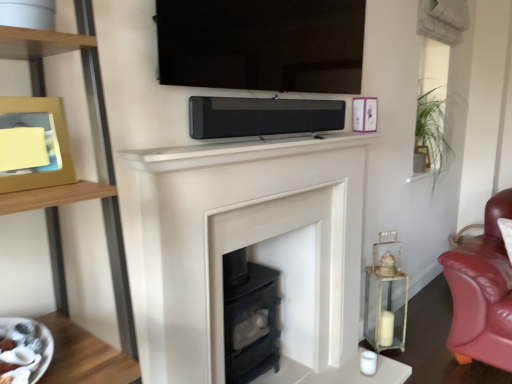
Question: Can you confirm if green leafy plant at upper right is wider than clear glass lantern at right?

Choices:
 (A) yes
 (B) no

Answer: (A)

Question: From a real-world perspective, does green leafy plant at upper right sit lower than clear glass lantern at right?

Choices:
 (A) yes
 (B) no

Answer: (B)

Question: Can you confirm if green leafy plant at upper right is shorter than clear glass lantern at right?

Choices:
 (A) no
 (B) yes

Answer: (B)

Question: From the image's perspective, is green leafy plant at upper right located beneath clear glass lantern at right?

Choices:
 (A) yes
 (B) no

Answer: (B)

Question: Would you say green leafy plant at upper right contains clear glass lantern at right?

Choices:
 (A) yes
 (B) no

Answer: (B)

Question: Considering their positions, is clear glass lantern at right located in front of or behind black matte soundbar at center?

Choices:
 (A) front
 (B) behind

Answer: (B)

Question: Looking at their shapes, would you say clear glass lantern at right is wider or thinner than black matte soundbar at center?

Choices:
 (A) wide
 (B) thin

Answer: (A)

Question: From the image's perspective, is clear glass lantern at right above or below black matte soundbar at center?

Choices:
 (A) above
 (B) below

Answer: (B)

Question: Do you think clear glass lantern at right is within black matte soundbar at center, or outside of it?

Choices:
 (A) outside
 (B) inside

Answer: (A)

Question: From their relative heights in the image, would you say black matte soundbar at center is taller or shorter than clear glass lantern at right?

Choices:
 (A) tall
 (B) short

Answer: (B)

Question: Choose the correct answer: Is black matte soundbar at center inside clear glass lantern at right or outside it?

Choices:
 (A) outside
 (B) inside

Answer: (A)

Question: Is black matte soundbar at center bigger or smaller than clear glass lantern at right?

Choices:
 (A) small
 (B) big

Answer: (A)

Question: Considering the positions of point (326, 127) and point (367, 306), is point (326, 127) closer or farther from the camera than point (367, 306)?

Choices:
 (A) closer
 (B) farther

Answer: (A)

Question: Does point (114, 359) appear closer or farther from the camera than point (8, 167)?

Choices:
 (A) closer
 (B) farther

Answer: (B)

Question: Is white glossy plate at lower left wider or thinner than wooden picture frame at left, which appears as the 2th picture frame when viewed from the top?

Choices:
 (A) thin
 (B) wide

Answer: (B)